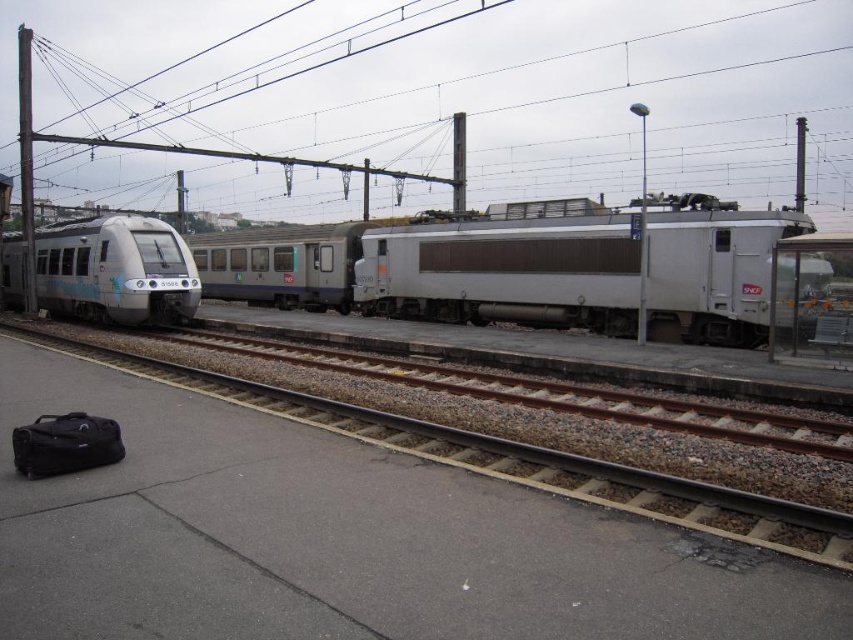
You are a railway worker inspecting the tracks between the gray gravel train track at center and the silver metallic train at left. Which track is closer to the right side of the platform?

The gray gravel train track at center is positioned on the right side of the silver metallic train at left, so it is closer to the right side of the platform.

You are a train conductor preparing to inspect the tracks ahead. From your vantage point, which object is closer to you between the silver metallic train at center and the gray gravel train track at center?

The silver metallic train at center is closer to you because the gray gravel train track at center is positioned behind it.